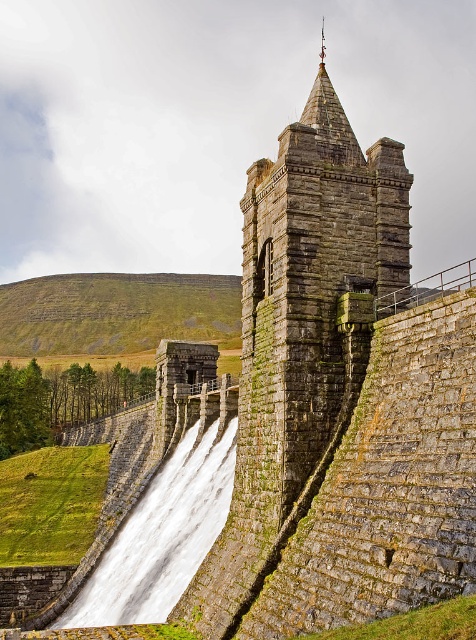
You are a drone operator tasked with capturing aerial footage of the historic stone structure. Your drone has a maximum flight range of 20 meters. If you are currently positioned near the rusty stone tower at upper center, can you fly your drone to the white stone waterfall at lower left without exceeding its range?

The rusty stone tower at upper center and white stone waterfall at lower left are 21.11 meters apart. Since the drone has a maximum range of 20 meters, it cannot reach the white stone waterfall at lower left from the rusty stone tower at upper center without exceeding its range.

You are a drone operator tasked with capturing aerial footage of the historic stone structure. The rusty stone tower at upper center is your primary focus. Given that the tower is positioned at coordinates point 0.456, 0.649, can you confirm if it is centrally located within the frame?

The rusty stone tower at upper center is located at point (308, 291), which indicates it is centrally positioned within the frame as per the coordinates provided.

You are standing in front of the historic stone structure. You want to take a photo of both the rusty stone tower at upper center and the white stone waterfall at lower left. Which object should you focus on first to ensure both are in clear view?

The rusty stone tower at upper center is closer to the viewer than the white stone waterfall at lower left, so you should focus on the rusty stone tower at upper center first to ensure both are in clear view.